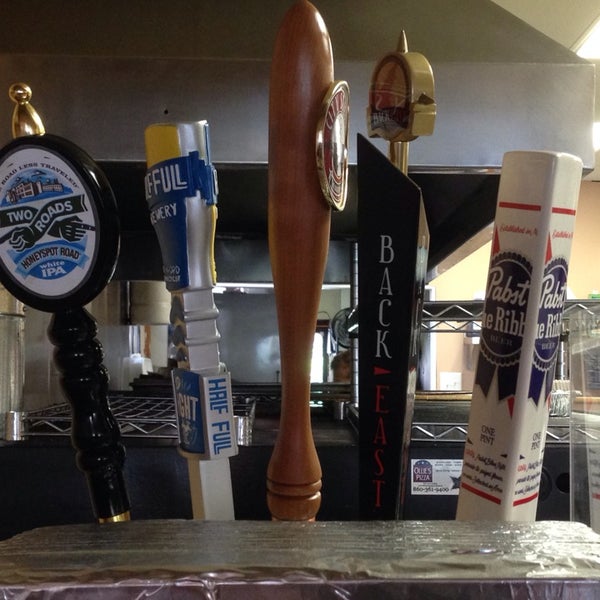
You are a GUI agent. You are given a task and a screenshot of the screen. Output one action in this format:
    pyautogui.click(x=<x>, y=<y>)
    Task: Click on the draught handles
    
    Given the screenshot: What is the action you would take?
    pyautogui.click(x=72, y=340), pyautogui.click(x=192, y=299), pyautogui.click(x=286, y=280), pyautogui.click(x=410, y=284), pyautogui.click(x=533, y=299)